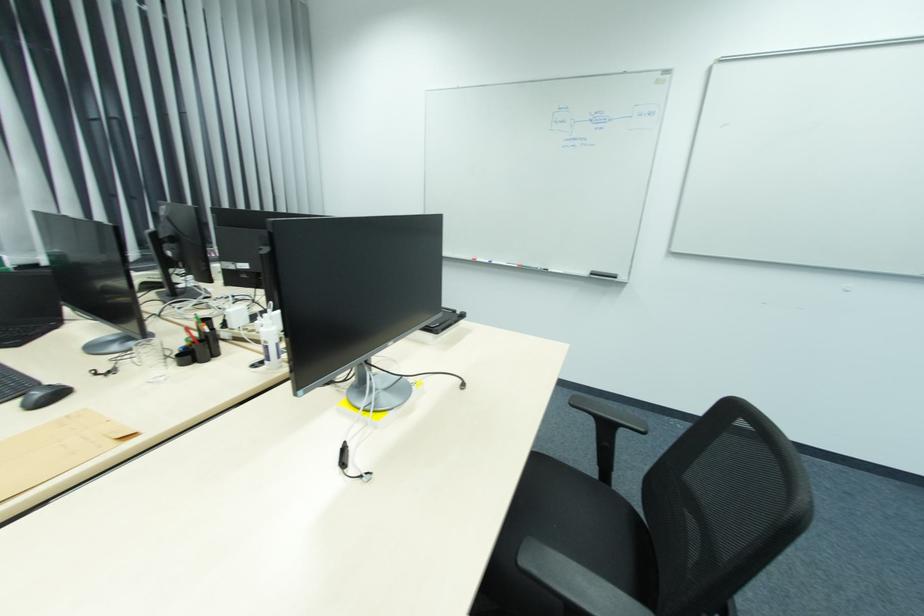
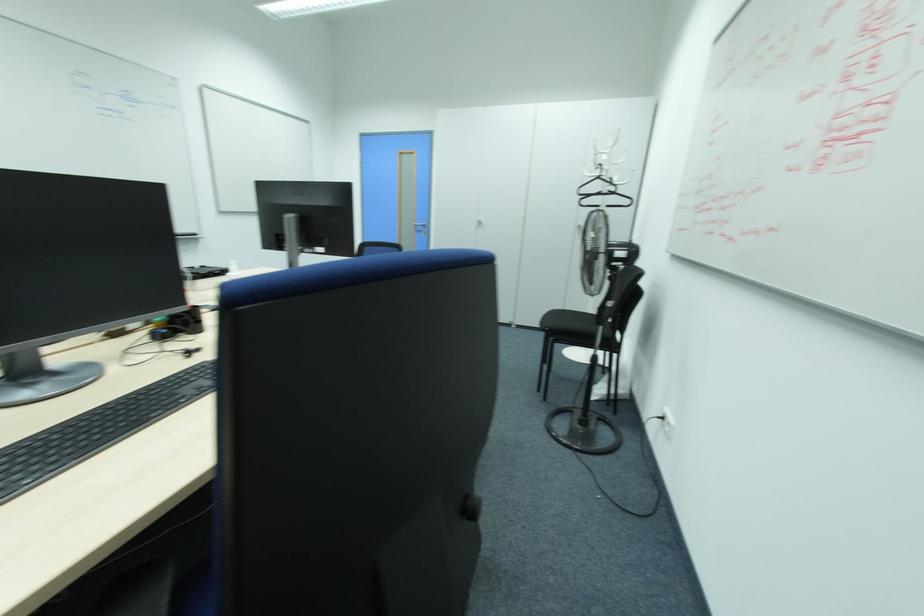
Question: I am providing you with two images of the same scene from different viewpoints. Please identify which objects are invisible in image2.

Choices:
 (A) chair sitting surface
 (B) whiteboard marker
 (C) white cabinet handle
 (D) plaid seat cushion

Answer: (B)